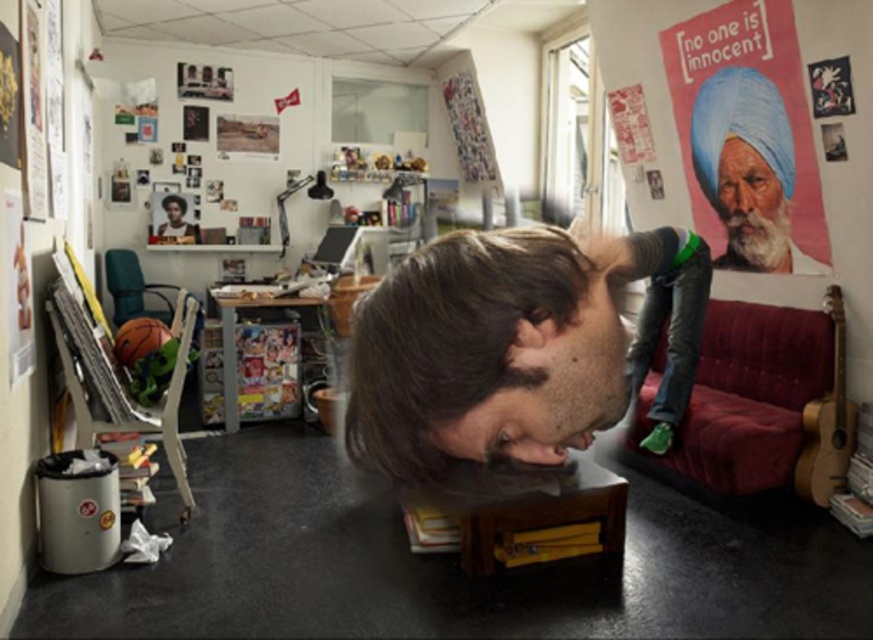
Question: Estimate the real-world distances between objects in this image. Which object is closer to the smooth blue fabric at upper right?

Choices:
 (A) white fluffy beard at upper right
 (B) matte plastic poster at upper right

Answer: (B)

Question: Does brown matte hair at center come in front of matte plastic poster at upper right?

Choices:
 (A) no
 (B) yes

Answer: (B)

Question: Can you confirm if brown matte hair at center is bigger than white beard at upper right?

Choices:
 (A) yes
 (B) no

Answer: (B)

Question: Which point is farther from the camera taking this photo?

Choices:
 (A) (746, 208)
 (B) (748, 234)
 (C) (746, 141)

Answer: (B)

Question: Estimate the real-world distances between objects in this image. Which object is farther from the white fluffy beard at upper right?

Choices:
 (A) matte plastic poster at upper right
 (B) smooth blue fabric at upper right

Answer: (B)

Question: Can you confirm if white beard at upper right is positioned to the right of white fluffy beard at upper right?

Choices:
 (A) no
 (B) yes

Answer: (A)